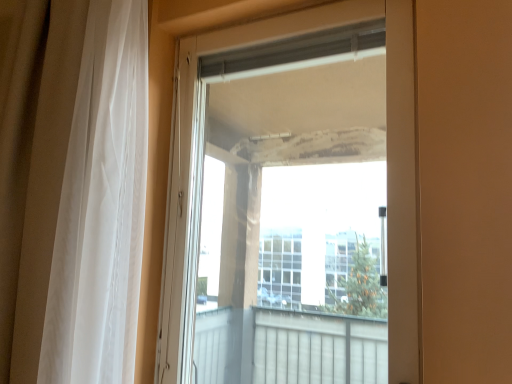
Question: Is white sheer curtain at left spatially inside transparent glass door at center, or outside of it?

Choices:
 (A) inside
 (B) outside

Answer: (B)

Question: From the image's perspective, is white sheer curtain at left above or below transparent glass door at center?

Choices:
 (A) below
 (B) above

Answer: (B)

Question: Considering their positions, is white sheer curtain at left located in front of or behind transparent glass door at center?

Choices:
 (A) behind
 (B) front

Answer: (B)

Question: From the image's perspective, is transparent glass door at center positioned above or below white sheer curtain at left?

Choices:
 (A) above
 (B) below

Answer: (B)

Question: Considering the relative positions of transparent glass door at center and white sheer curtain at left in the image provided, is transparent glass door at center to the left or to the right of white sheer curtain at left?

Choices:
 (A) left
 (B) right

Answer: (B)

Question: From a real-world perspective, relative to white sheer curtain at left, is transparent glass door at center vertically above or below?

Choices:
 (A) above
 (B) below

Answer: (B)

Question: Considering the positions of transparent glass door at center and white sheer curtain at left in the image, is transparent glass door at center wider or thinner than white sheer curtain at left?

Choices:
 (A) thin
 (B) wide

Answer: (A)